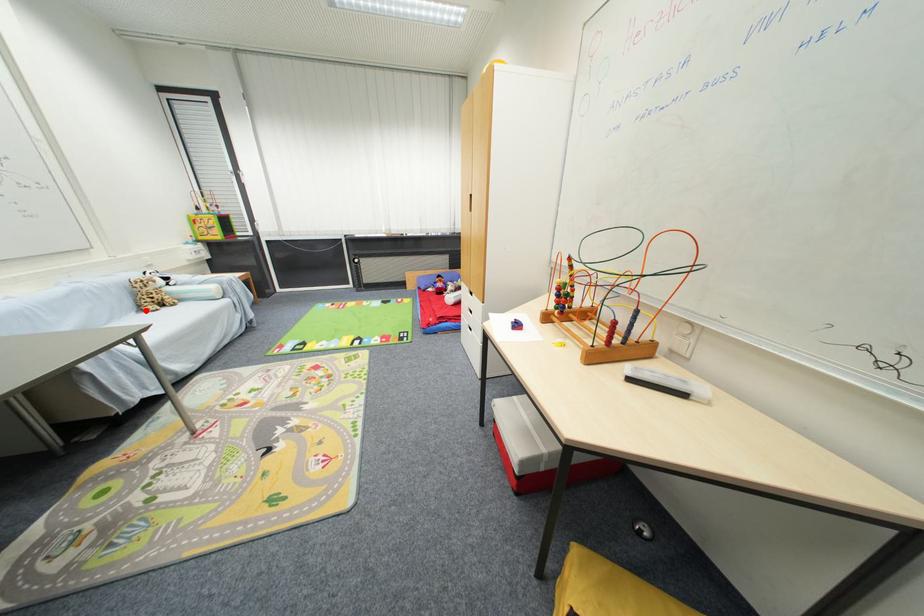
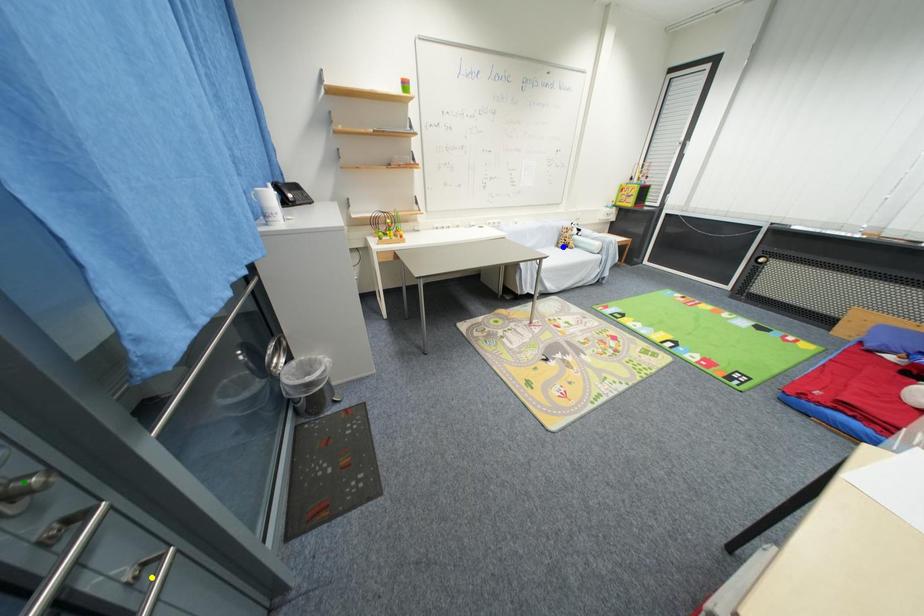
Question: I am providing you with two images of the same scene from different viewpoints. A red point is marked on the first image. You are given multiple points on the second image. Which spot in image 2 lines up with the point in image 1?

Choices:
 (A) blue point
 (B) green point
 (C) yellow point

Answer: (A)